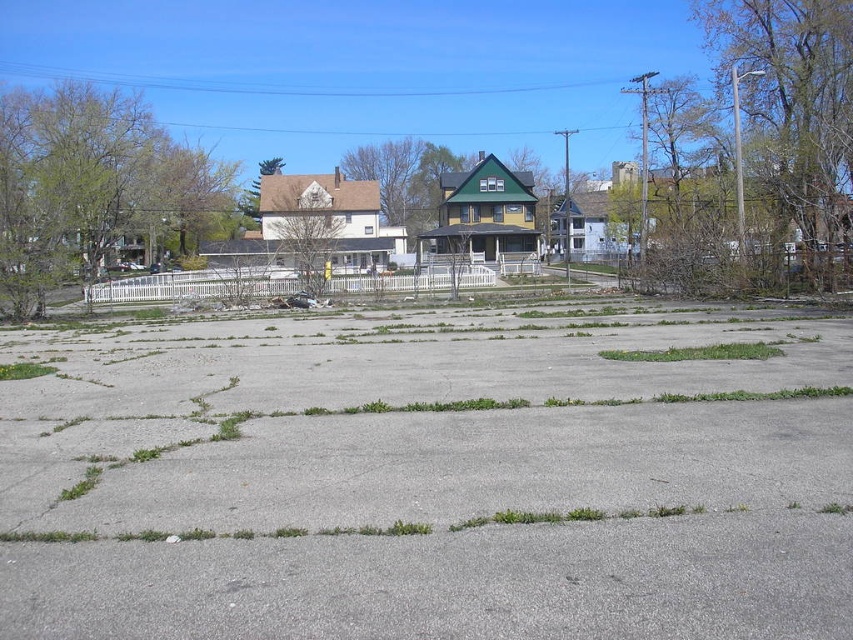
You are a city planner evaluating the abandoned lot. You see the gray concrete pavement at center and the green grass at center. Which area is bigger in size?

The gray concrete pavement at center is larger in size than the green grass at center.